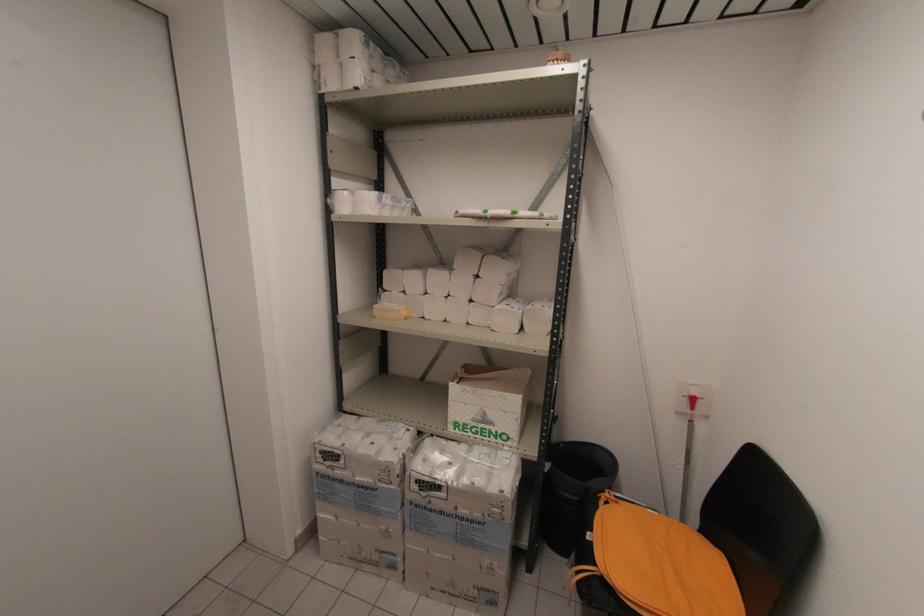
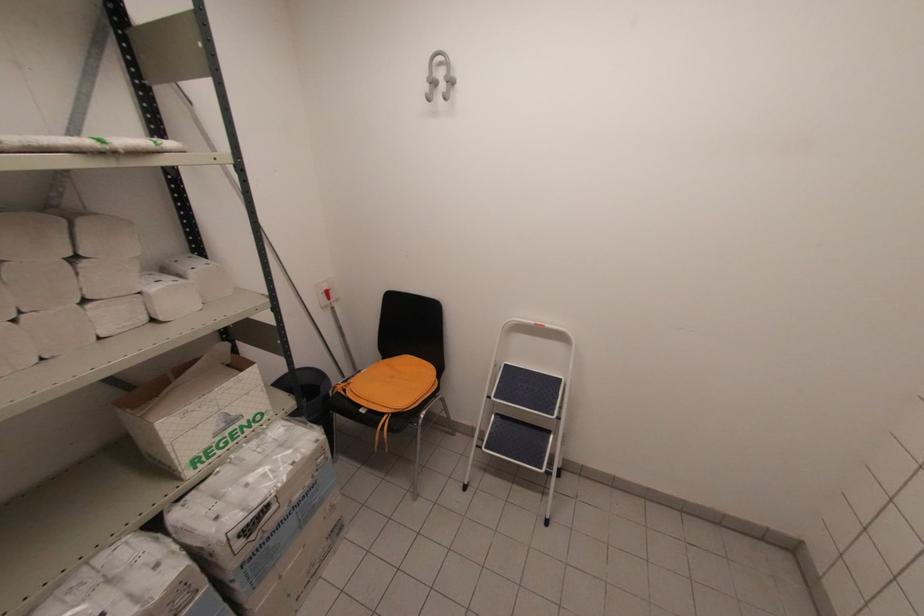
In the second image, find the point that corresponds to the point at 694,408 in the first image.

(330, 299)